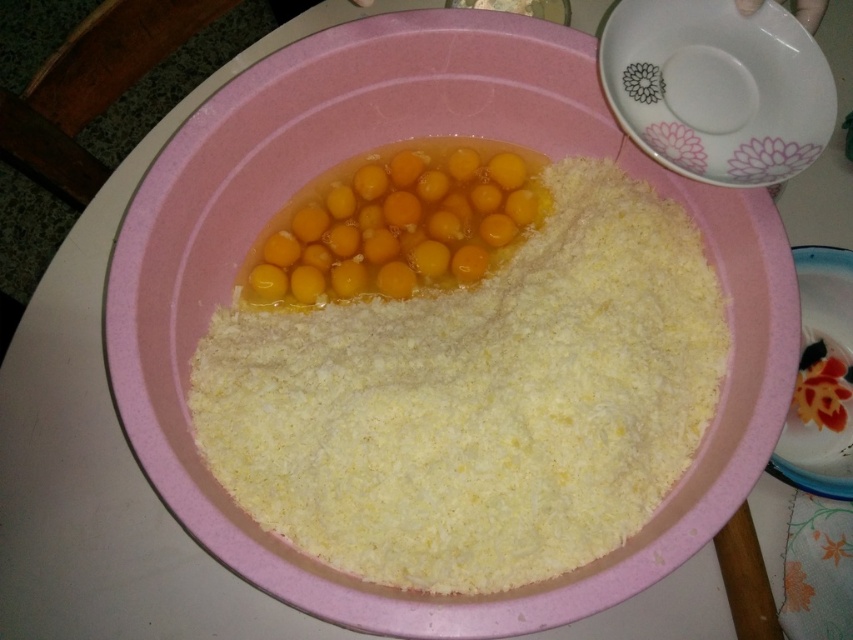
You are preparing a meal and need to place both the white ceramic plate at upper right and the porcelain plate at lower right on a shelf that can only hold items up to 10 cm in height. Which plate should you choose to fit on the shelf?

The white ceramic plate at upper right is shorter than the porcelain plate at lower right, so the white ceramic plate at upper right should be chosen to fit on the shelf since it is under 10 cm in height.

You are a chef preparing a dish and need to check the distance between the yellow powder at center and the white ceramic plate at upper right. Can you determine if the plate is above or below the powder?

The yellow powder at center is positioned under the white ceramic plate at upper right, so the plate is above the powder.